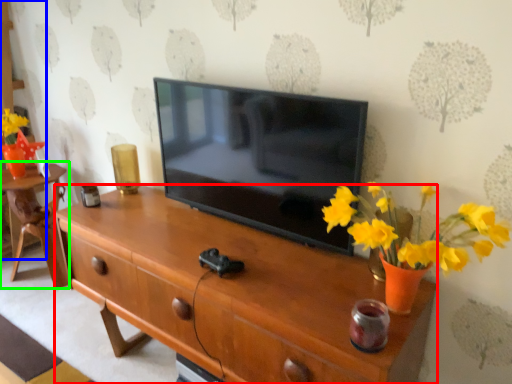
Question: Which object is the closest to the desk (highlighted by a red box)? Choose among these: cabinetry (highlighted by a blue box) or table (highlighted by a green box).

Choices:
 (A) cabinetry
 (B) table

Answer: (B)